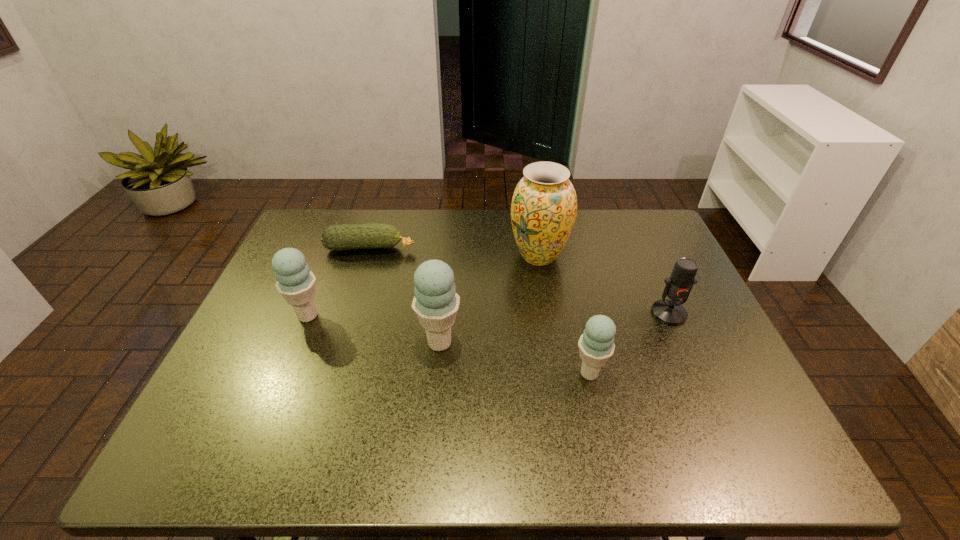
Identify the location of vacant region at the far edge of the desktop. This screenshot has width=960, height=540. (499, 234).

Identify the location of blank area at the near edge. (416, 390).

The width and height of the screenshot is (960, 540). In the image, there is a desktop. Identify the location of vacant area at the left edge. (262, 367).

Locate an element on the screen. The image size is (960, 540). free location at the right edge is located at coordinates (694, 372).

This screenshot has height=540, width=960. In order to click on free location at the near left corner in this screenshot , I will do `click(240, 397)`.

This screenshot has height=540, width=960. In order to click on vacant space at the far right corner of the desktop in this screenshot , I will do `click(667, 244)`.

Locate an element on the screen. vacant space at the near right corner of the desktop is located at coordinates (757, 414).

You are a GUI agent. You are given a task and a screenshot of the screen. Output one action in this format:
    pyautogui.click(x=<x>, y=<y>)
    Task: Click on the free area in between the rightmost object and the leftmost ice cream
    The height and width of the screenshot is (540, 960).
    Given the screenshot: What is the action you would take?
    pyautogui.click(x=489, y=315)

At what (x,y) coordinates should I click in order to perform the action: click on vacant area that lies between the shortest ice cream and the second ice cream from left to right. Please return your answer as a coordinate pair (x, y). The height and width of the screenshot is (540, 960). Looking at the image, I should click on (515, 358).

This screenshot has width=960, height=540. I want to click on empty location between the microphone and the second ice cream from left to right, so click(554, 328).